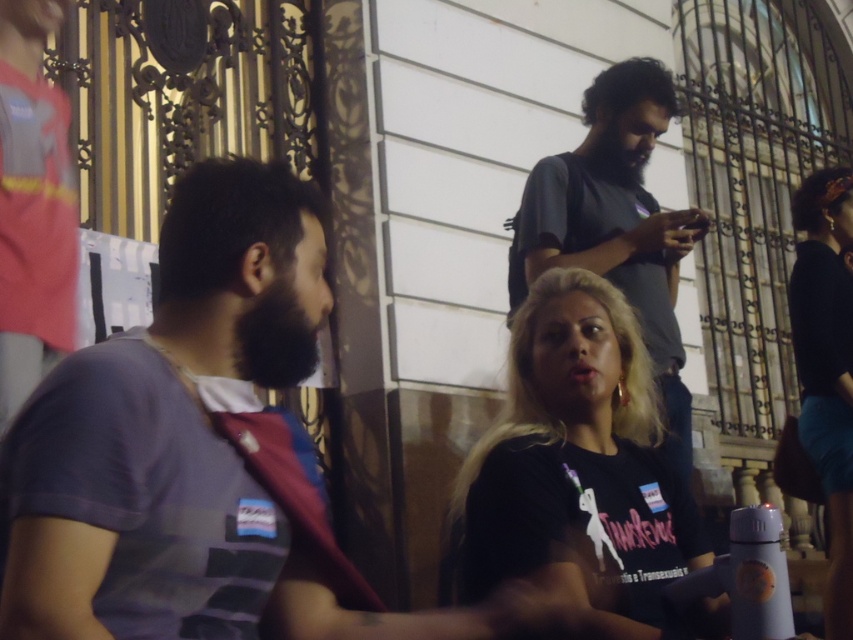
Question: Does black matte shirt at center appear over gray cotton t-shirt at upper center?

Choices:
 (A) yes
 (B) no

Answer: (B)

Question: Among these points, which one is farthest from the camera?

Choices:
 (A) (619, 440)
 (B) (827, 486)
 (C) (601, 253)
 (D) (53, 460)

Answer: (B)

Question: Does black matte shirt at center have a lesser width compared to gray cotton t-shirt at upper center?

Choices:
 (A) no
 (B) yes

Answer: (B)

Question: Which object is the closest to the purple striped shirt at left?

Choices:
 (A) black matte shirt at center
 (B) black matte shirt at upper right

Answer: (A)

Question: Does black matte shirt at center have a larger size compared to gray cotton t-shirt at upper center?

Choices:
 (A) yes
 (B) no

Answer: (B)

Question: Which point is closer to the camera?

Choices:
 (A) (842, 509)
 (B) (688, 502)

Answer: (B)